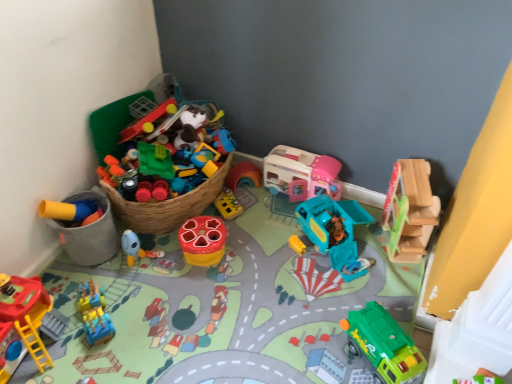
Find the location of `vacant area that lies between rubberized yellow toy at left, which appears as the 8th toy when viewed from the right, and blue plastic train at lower left, acting as the seventh toy starting from the right`. vacant area that lies between rubberized yellow toy at left, which appears as the 8th toy when viewed from the right, and blue plastic train at lower left, acting as the seventh toy starting from the right is located at coordinates (102, 285).